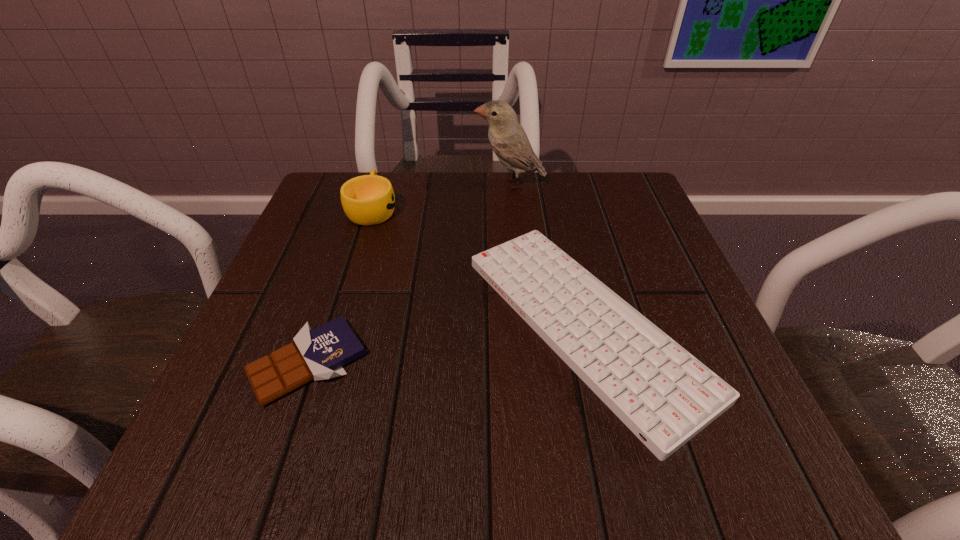
Find the location of a particular element. The height and width of the screenshot is (540, 960). free location at the left edge of the desktop is located at coordinates (361, 272).

Where is `free space at the right edge`? This screenshot has height=540, width=960. free space at the right edge is located at coordinates (687, 289).

In the image, there is a desktop. Identify the location of vacant space at the far left corner. (335, 192).

Locate an element on the screen. free space at the near left corner is located at coordinates (189, 453).

At what (x,y) coordinates should I click in order to perform the action: click on blank space at the far right corner of the desktop. Please return your answer as a coordinate pair (x, y). Image resolution: width=960 pixels, height=540 pixels. Looking at the image, I should click on (624, 183).

Find the location of a particular element. Image resolution: width=960 pixels, height=540 pixels. unoccupied area between the tallest object and the second tallest object is located at coordinates (442, 197).

Where is `empty location between the third shortest object and the chocolate bar`? This screenshot has height=540, width=960. empty location between the third shortest object and the chocolate bar is located at coordinates (341, 286).

At what (x,y) coordinates should I click in order to perform the action: click on free spot between the cup and the chocolate bar. Please return your answer as a coordinate pair (x, y). Looking at the image, I should click on (341, 286).

The height and width of the screenshot is (540, 960). Find the location of `vacant area that lies between the chocolate bar and the tallest object`. vacant area that lies between the chocolate bar and the tallest object is located at coordinates (409, 273).

The image size is (960, 540). I want to click on vacant space that's between the chocolate bar and the cup, so click(x=341, y=286).